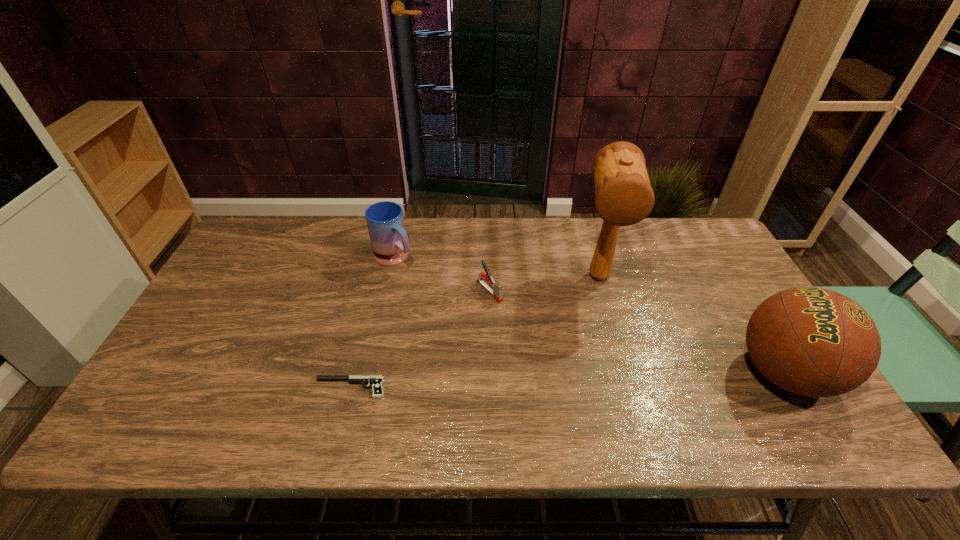
Locate an element on the screen. The width and height of the screenshot is (960, 540). free spot on the desktop that is between the pistol and the fourth shortest object and is positioned on the strike surface of the fourth object from left to right is located at coordinates (606, 379).

You are a GUI agent. You are given a task and a screenshot of the screen. Output one action in this format:
    pyautogui.click(x=<x>, y=<y>)
    Task: Click on the free space on the desktop that is between the pistol and the basketball and is positioned on the side of the mug with the handle
    Image resolution: width=960 pixels, height=540 pixels.
    Given the screenshot: What is the action you would take?
    pyautogui.click(x=532, y=382)

I want to click on vacant space on the desktop that is between the shortest object and the rightmost object and is positioned on the handle side of the third object from left to right, so click(x=583, y=380).